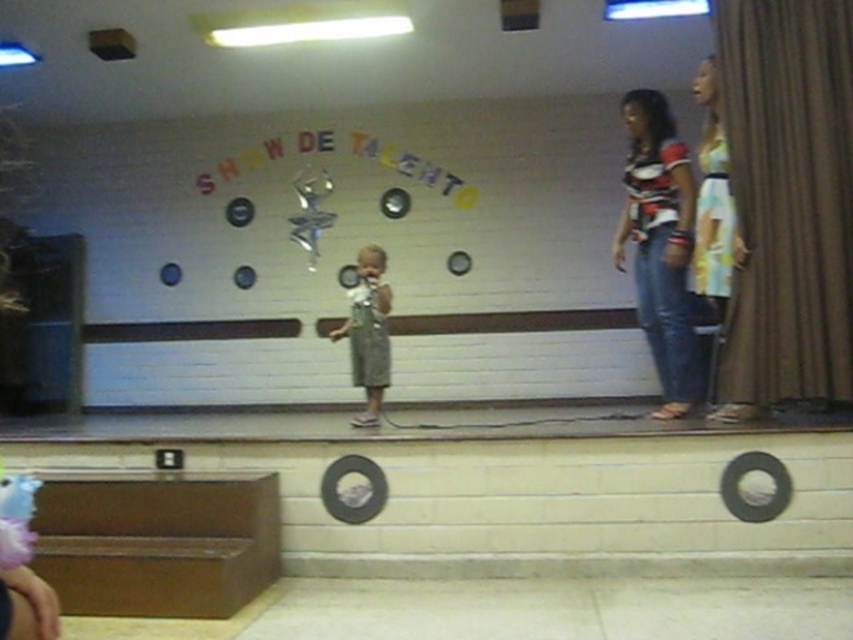
You are an event organizer who needs to arrange seating for the performers. The striped fabric shirt at right and the green fabric dress at center are part of the performers. Which performer should be seated closer to the front to ensure visibility for the audience?

The striped fabric shirt at right is much taller than the green fabric dress at center, so the green fabric dress at center should be seated closer to the front to ensure visibility for the audience.

You are an event organizer planning to place a small podium between the yellow floral dress at right and the green fabric dress at center. Based on their sizes, which dress should be closer to the podium to ensure it doesn

The yellow floral dress at right is larger than the green fabric dress at center, so placing the podium closer to the green fabric dress at center would provide more space for the larger yellow floral dress at right to move around.